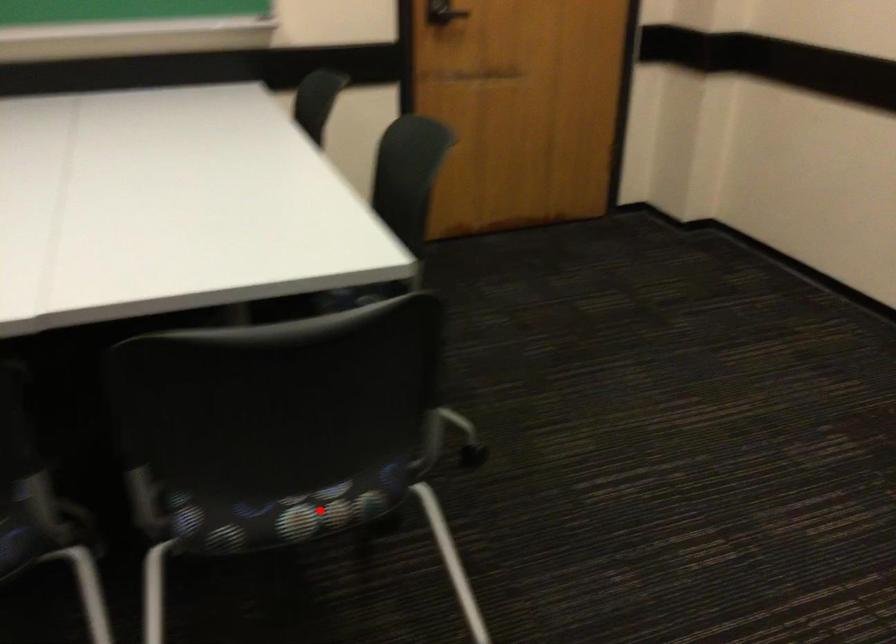
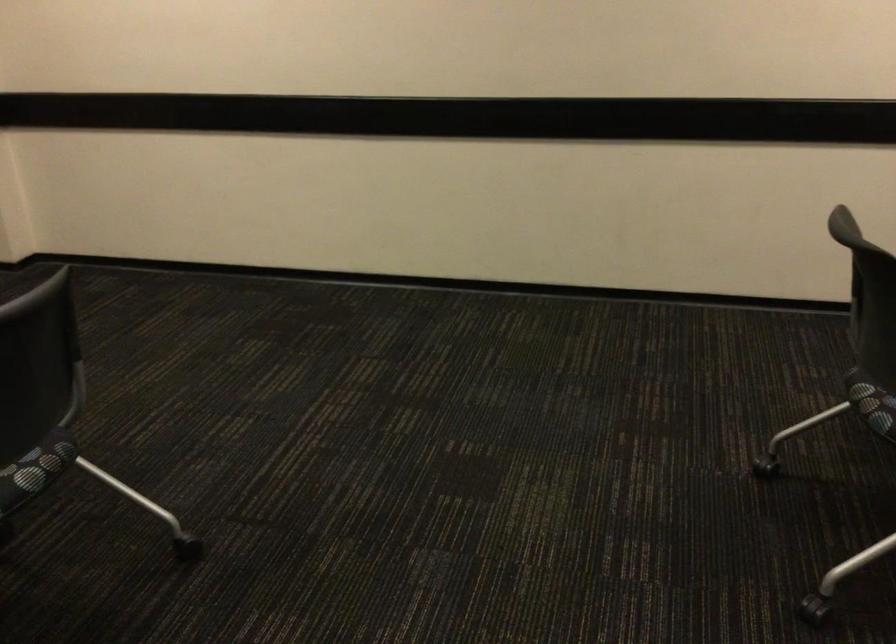
Question: A red point is marked in image1. In image2, is the corresponding 3D point closer to the camera or farther? Reply with the corresponding letter.

Choices:
 (A) The corresponding 3D point is closer.
 (B) The corresponding 3D point is farther.

Answer: (B)